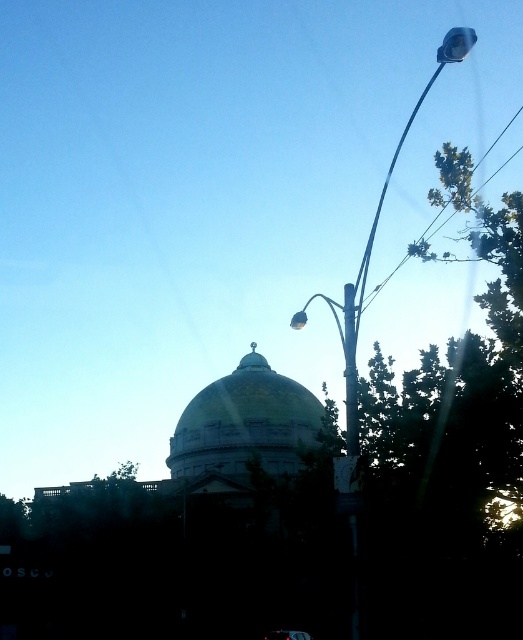
You are a photographer planning to take a photo of the shiny black car at center and the metallic pole at right. Based on their sizes in the image, which object should you focus on first if you want to ensure both are in sharp focus?

The metallic pole at right is larger in size than the shiny black car at center, so focusing on the metallic pole at right first would ensure both are in sharp focus since it is closer to the camera.

From the picture: You are standing at point (245, 422) in the scene. Looking around, you see the gold yellow dome at center. What is the closest object to you at this location?

The closest object to you at point (245, 422) is the gold yellow dome at center, as it is located directly at this coordinate.